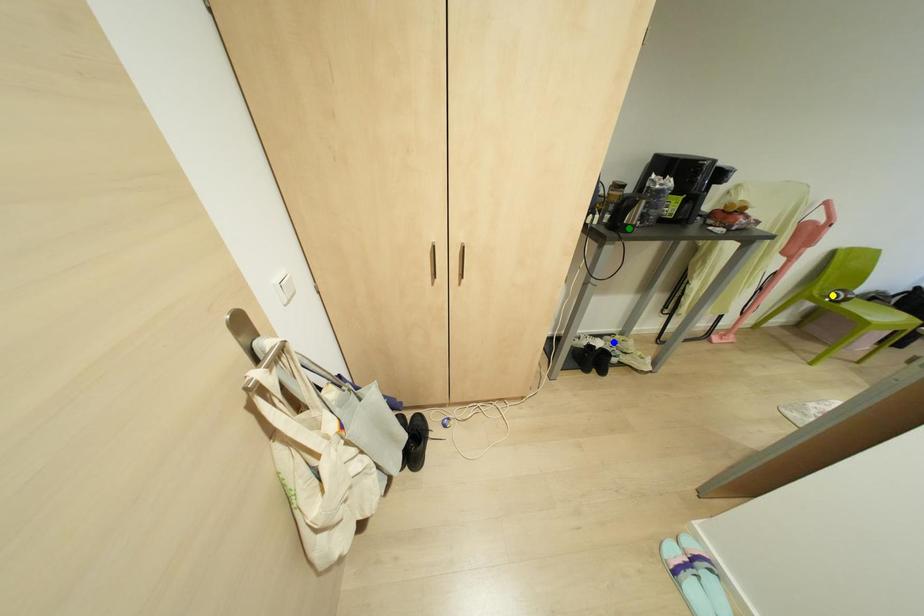
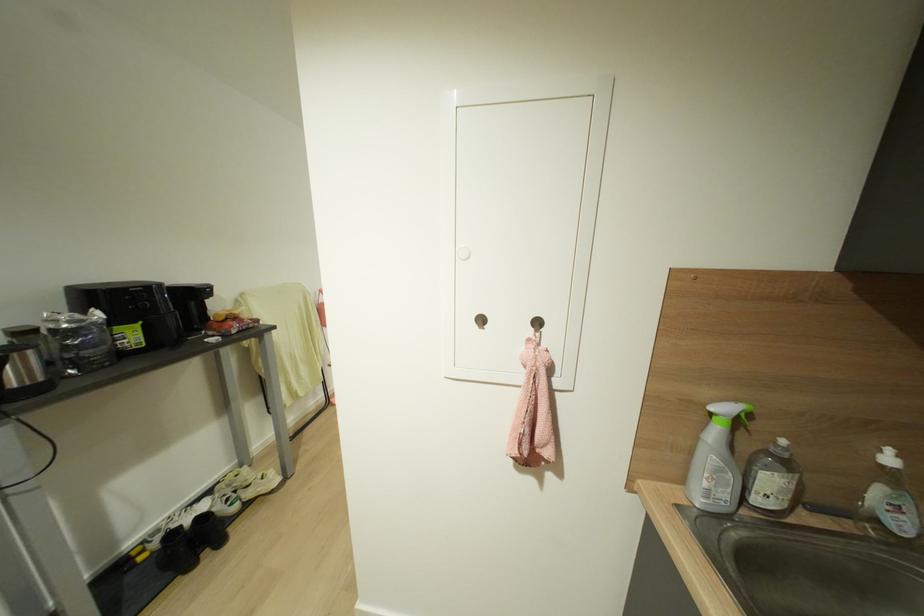
I am providing you with two images of the same scene from different viewpoints. Three points are marked in image1. Which point corresponds to a part or object that is occluded in image2?In image1, three points are marked. Which of them correspond to a part or object that is occluded in image2?Among the three points shown in image1, which one corresponds to a part or object that is no longer visible due to occlusion in image2?

yellow point cannot be seen in image2.